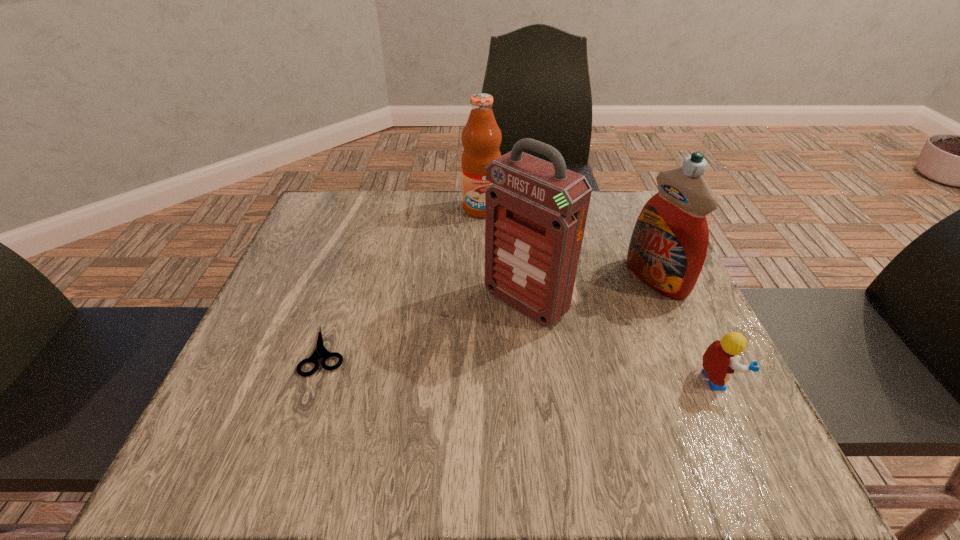
The width and height of the screenshot is (960, 540). Find the location of `vacant space on the desktop that is between the shortest object and the Lego and is positioned on the front surface of the detergent`. vacant space on the desktop that is between the shortest object and the Lego and is positioned on the front surface of the detergent is located at coordinates (484, 362).

You are a GUI agent. You are given a task and a screenshot of the screen. Output one action in this format:
    pyautogui.click(x=<x>, y=<y>)
    Task: Click on the vacant space on the desktop that is between the shears and the fourth tallest object and is positioned on the front label of the fruit juice
    
    Given the screenshot: What is the action you would take?
    pyautogui.click(x=529, y=366)

Locate an element on the screen. The image size is (960, 540). free space on the desktop that is between the leftmost object and the second shortest object and is positioned on the front-facing side of the tallest object is located at coordinates (459, 361).